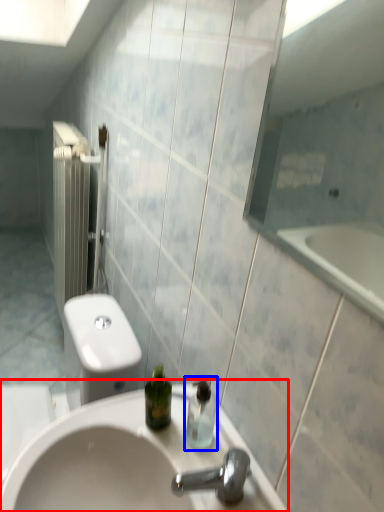
Question: Which object is closer to the camera taking this photo, sink (highlighted by a red box) or soap dispenser (highlighted by a blue box)?

Choices:
 (A) sink
 (B) soap dispenser

Answer: (A)